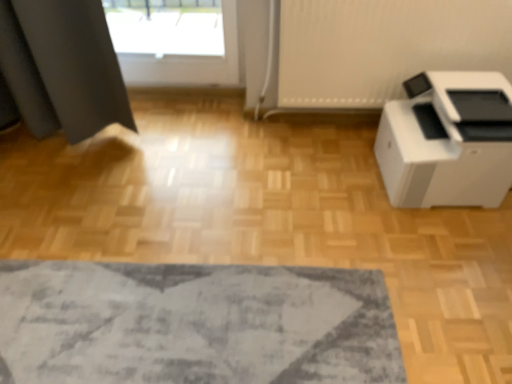
Where is `vacant space in front of white plastic printer at right`? The height and width of the screenshot is (384, 512). vacant space in front of white plastic printer at right is located at coordinates (439, 253).